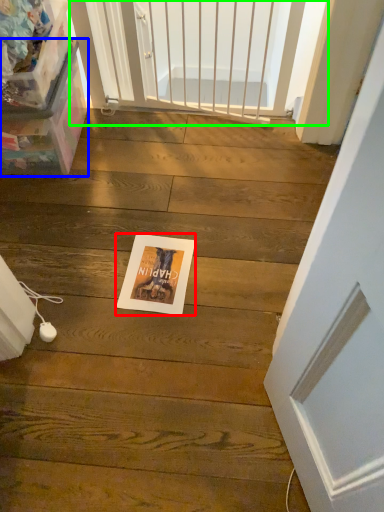
Question: Which is nearer to the postcard (highlighted by a red box)? box (highlighted by a blue box) or screen door (highlighted by a green box).

Choices:
 (A) box
 (B) screen door

Answer: (A)